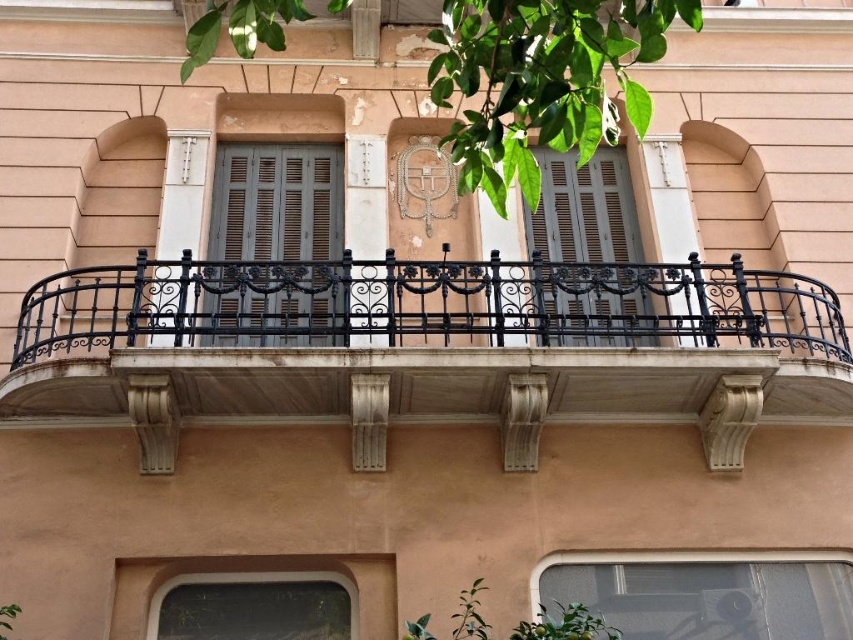
Question: Is transparent glass window at lower right further to the viewer compared to matte gray shutter at center?

Choices:
 (A) yes
 (B) no

Answer: (B)

Question: Which of the following is the farthest from the observer?

Choices:
 (A) matte gray shutter at center
 (B) black wrought iron balcony at center
 (C) matte gray wood shutter at center

Answer: (A)

Question: Which of these objects is positioned closest to the transparent glass window at lower right?

Choices:
 (A) matte gray wood shutter at center
 (B) matte gray shutter at center
 (C) clear glass window at lower center
 (D) black wrought iron balcony at center

Answer: (D)

Question: Does transparent glass window at lower right have a greater width compared to clear glass window at lower center?

Choices:
 (A) yes
 (B) no

Answer: (A)

Question: Where is matte gray shutter at center located in relation to clear glass window at lower center in the image?

Choices:
 (A) below
 (B) above

Answer: (B)

Question: Which object is the farthest from the matte gray wood shutter at center?

Choices:
 (A) black wrought iron balcony at center
 (B) matte gray shutter at center

Answer: (B)